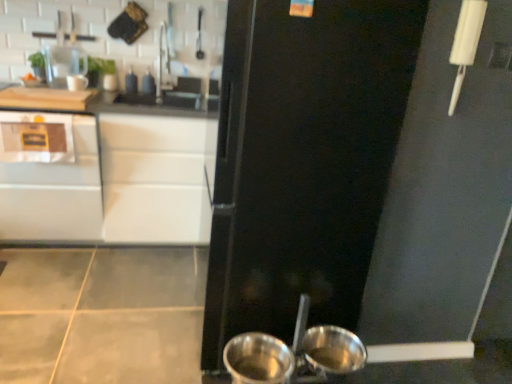
Question: From the image's perspective, is shiny metallic pot at lower center positioned above or below brushed metal faucet at upper center?

Choices:
 (A) above
 (B) below

Answer: (B)

Question: In the image, is shiny metallic pot at lower center positioned in front of or behind brushed metal faucet at upper center?

Choices:
 (A) behind
 (B) front

Answer: (B)

Question: Which object is positioned farthest from the brushed metal faucet at upper center?

Choices:
 (A) satin white cabinet at left
 (B) metallic silver basin at lower center
 (C) shiny metallic pot at lower center
 (D) white glossy cabinet at upper left
 (E) black matte refrigerator at center

Answer: (B)

Question: Estimate the real-world distances between objects in this image. Which object is farther from the metallic silver basin at lower center?

Choices:
 (A) white glossy cabinet at upper left
 (B) brushed metal faucet at upper center
 (C) shiny metallic pot at lower center
 (D) black matte refrigerator at center
 (E) satin white cabinet at left

Answer: (B)